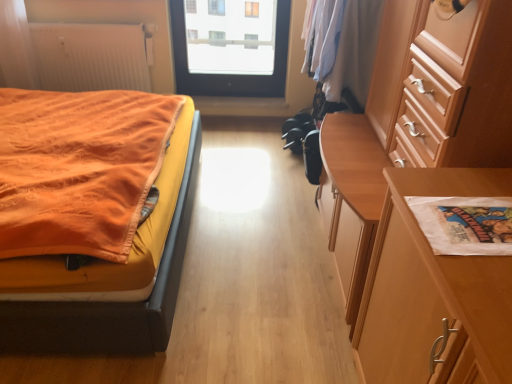
Question: Can you confirm if orange fabric bed at left is shorter than white ribbed radiator at upper left?

Choices:
 (A) yes
 (B) no

Answer: (B)

Question: Would you consider orange fabric bed at left to be distant from white ribbed radiator at upper left?

Choices:
 (A) yes
 (B) no

Answer: (A)

Question: Can you confirm if orange fabric bed at left is positioned to the right of white ribbed radiator at upper left?

Choices:
 (A) no
 (B) yes

Answer: (B)

Question: Are orange fabric bed at left and white ribbed radiator at upper left beside each other?

Choices:
 (A) no
 (B) yes

Answer: (A)

Question: Can you confirm if orange fabric bed at left is bigger than white ribbed radiator at upper left?

Choices:
 (A) no
 (B) yes

Answer: (B)

Question: Relative to white ribbed radiator at upper left, is transparent glass door at upper center in front or behind?

Choices:
 (A) front
 (B) behind

Answer: (B)

Question: Is point (275, 56) positioned closer to the camera than point (126, 26)?

Choices:
 (A) farther
 (B) closer

Answer: (A)

Question: From a real-world perspective, is transparent glass door at upper center positioned above or below white ribbed radiator at upper left?

Choices:
 (A) below
 (B) above

Answer: (B)

Question: Considering the positions of transparent glass door at upper center and white ribbed radiator at upper left in the image, is transparent glass door at upper center wider or thinner than white ribbed radiator at upper left?

Choices:
 (A) wide
 (B) thin

Answer: (B)

Question: From a real-world perspective, is orange fabric bed at left above or below white paper at right?

Choices:
 (A) above
 (B) below

Answer: (B)

Question: Visually, is orange fabric bed at left positioned to the left or to the right of white paper at right?

Choices:
 (A) right
 (B) left

Answer: (B)

Question: Do you think orange fabric bed at left is within white paper at right, or outside of it?

Choices:
 (A) outside
 (B) inside

Answer: (A)

Question: From their relative heights in the image, would you say orange fabric bed at left is taller or shorter than white paper at right?

Choices:
 (A) short
 (B) tall

Answer: (B)

Question: From the image's perspective, is white paper bag at right located above or below white paper at right?

Choices:
 (A) above
 (B) below

Answer: (B)

Question: Based on their sizes in the image, would you say white paper bag at right is bigger or smaller than white paper at right?

Choices:
 (A) small
 (B) big

Answer: (B)